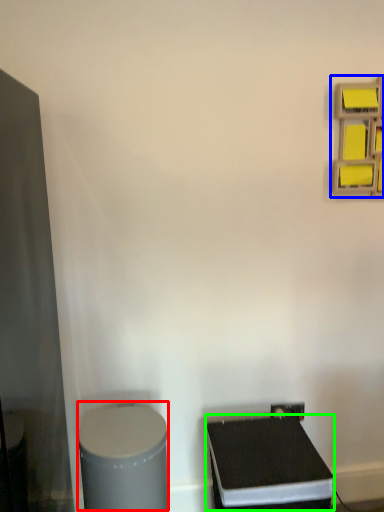
Question: Based on their relative distances, which object is farther from wide (highlighted by a red box)? Choose from shelf (highlighted by a blue box) and wide (highlighted by a green box).

Choices:
 (A) shelf
 (B) wide

Answer: (A)